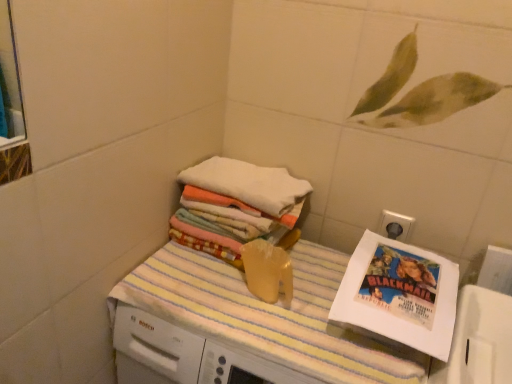
Find the location of a particular element. Image resolution: width=512 pixels, height=384 pixels. vacant region to the left of white paper comic book at right is located at coordinates (312, 302).